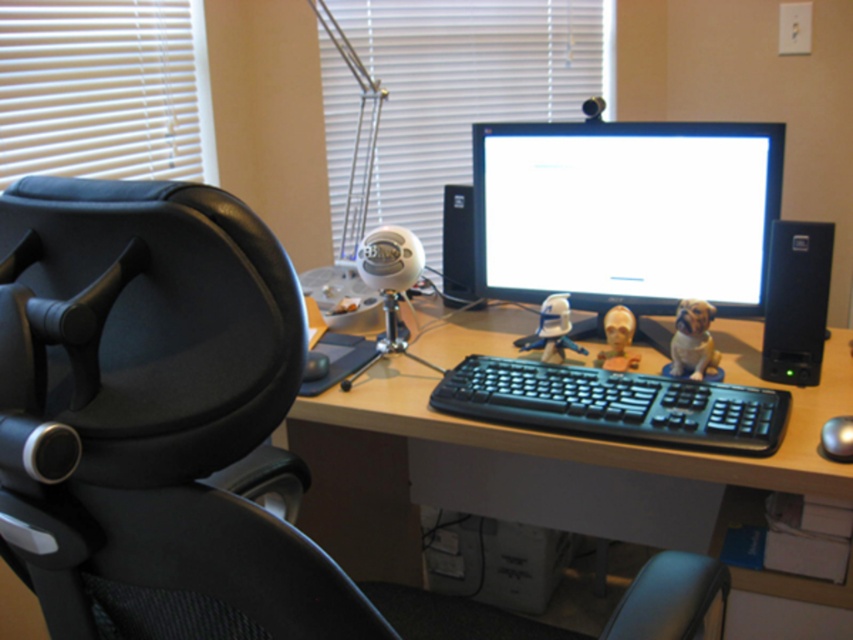
Question: Considering the real-world distances, which object is farthest from the white plastic blinds at upper left?

Choices:
 (A) fuzzy beige dog at center right
 (B) matte plastic skull at center
 (C) white matte figurine at center

Answer: (A)

Question: From the image, what is the correct spatial relationship of black mesh swivel chair at left in relation to white matte blinds at upper center?

Choices:
 (A) above
 (B) below

Answer: (B)

Question: Estimate the real-world distances between objects in this image. Which object is farther from the glossy metallic mouse at center?

Choices:
 (A) matte plastic skull at center
 (B) matte black monitor at center

Answer: (B)

Question: Which point is closer to the camera taking this photo?

Choices:
 (A) (136, 112)
 (B) (566, 330)

Answer: (B)

Question: Does black mesh swivel chair at left appear under wooden desk at center?

Choices:
 (A) no
 (B) yes

Answer: (A)

Question: Does matte black monitor at center appear under matte plastic skull at center?

Choices:
 (A) yes
 (B) no

Answer: (B)